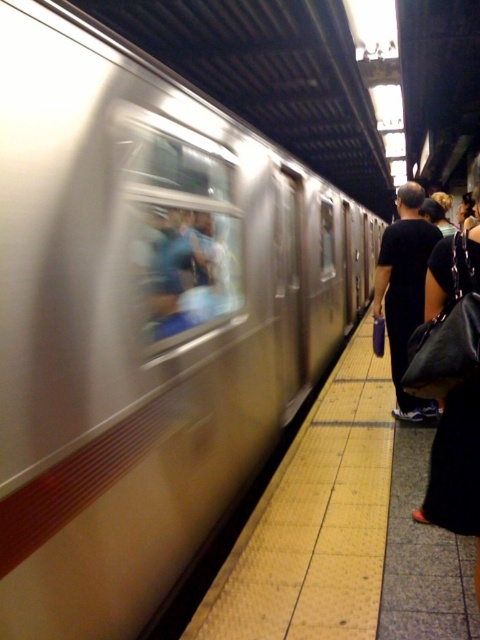
Question: Does yellow tile platform at center have a greater width compared to black fabric bag at right?

Choices:
 (A) no
 (B) yes

Answer: (B)

Question: Which of the following is the farthest from the observer?

Choices:
 (A) (431, 406)
 (B) (241, 588)

Answer: (A)

Question: Is yellow tile platform at center to the right of black fabric bag at right from the viewer's perspective?

Choices:
 (A) yes
 (B) no

Answer: (B)

Question: Where is yellow tile platform at center located in relation to black fabric bag at right in the image?

Choices:
 (A) right
 (B) left

Answer: (B)

Question: Which object appears farthest from the camera in this image?

Choices:
 (A) yellow tile platform at center
 (B) black fabric bag at right

Answer: (B)